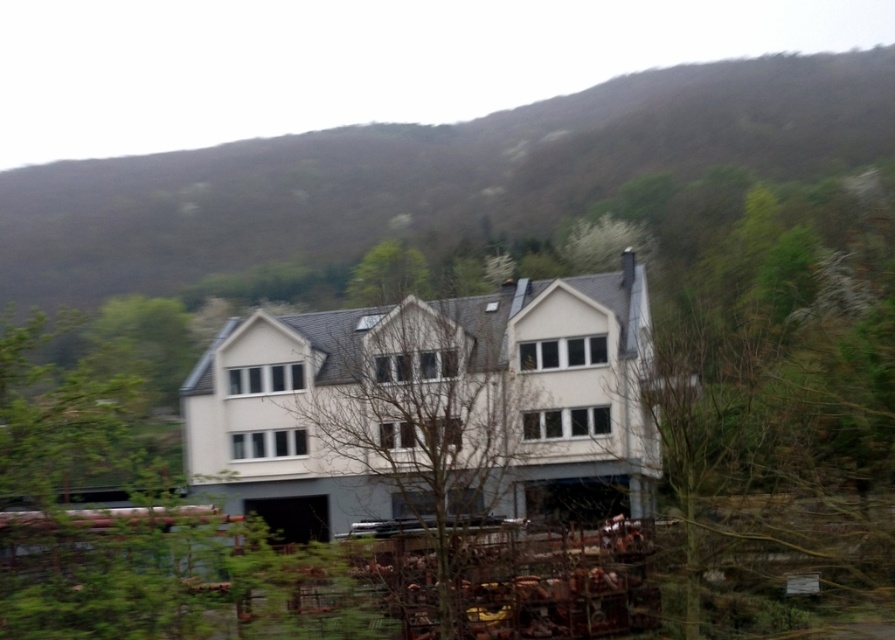
You are a gardener assessing the front yard of the house. You see a green leafy tree at center and bare branches at center. Which one has a wider spread?

The green leafy tree at center has a wider spread than the bare branches at center.

Looking at this image, you are standing in front of the house and notice two points marked on the ground. The first point is at coordinates point [372,204] and the second is at point [385,349]. Which point is closer to you as you face the house?

Point [372,204] is closer to you because it is further to the viewer than point [385,349].